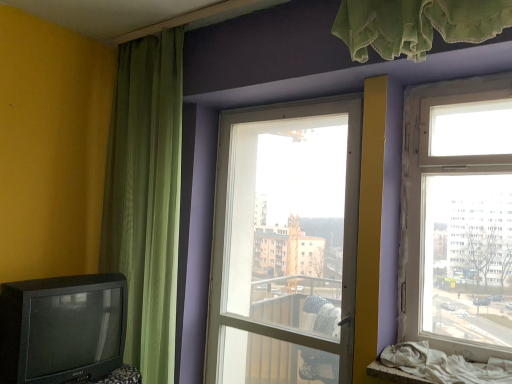
Describe the element at coordinates (146, 197) in the screenshot. The height and width of the screenshot is (384, 512). I see `green sheer curtain at left` at that location.

Where is `green sheer curtain at left`? The height and width of the screenshot is (384, 512). green sheer curtain at left is located at coordinates (146, 197).

Is transparent glass door at center, the first window viewed from the left, turned away from matte black television at lower left?

No, transparent glass door at center, the first window viewed from the left,'s orientation is not away from matte black television at lower left.

Where is `window that is the 1st one above the matte black television at lower left (from a real-world perspective)`? The height and width of the screenshot is (384, 512). window that is the 1st one above the matte black television at lower left (from a real-world perspective) is located at coordinates (285, 244).

Is transparent glass door at center, the 1th window in the back-to-front sequence, outside of matte black television at lower left?

transparent glass door at center, the 1th window in the back-to-front sequence, lies outside matte black television at lower left's area.

From a real-world perspective, is transparent glass door at center, placed as the second window when sorted from right to left, below matte black television at lower left?

No, from a real-world perspective, transparent glass door at center, placed as the second window when sorted from right to left, is not below matte black television at lower left.

How different are the orientations of clear glass window at upper right, which is counted as the first window, starting from the front, and matte black television at lower left in degrees?

90 degrees separate the facing orientations of clear glass window at upper right, which is counted as the first window, starting from the front, and matte black television at lower left.

Is clear glass window at upper right, positioned as the second window in left-to-right order, positioned in front of matte black television at lower left?

Yes, it is.

Can you confirm if clear glass window at upper right, the first window from the right, is wider than matte black television at lower left?

Incorrect, the width of clear glass window at upper right, the first window from the right, does not surpass that of matte black television at lower left.

Is clear glass window at upper right, positioned as the second window in left-to-right order, to the left of matte black television at lower left from the viewer's perspective?

In fact, clear glass window at upper right, positioned as the second window in left-to-right order, is to the right of matte black television at lower left.

From the image's perspective, is matte black television at lower left on transparent glass door at center, placed as the second window when sorted from right to left?

No, from the image's perspective, matte black television at lower left is not on top of transparent glass door at center, placed as the second window when sorted from right to left.

Which is behind, matte black television at lower left or transparent glass door at center, which is the second window from front to back?

transparent glass door at center, which is the second window from front to back, is further from the camera.

Is matte black television at lower left positioned with its back to transparent glass door at center, which is the second window from front to back?

No, matte black television at lower left is not facing away from transparent glass door at center, which is the second window from front to back.

Considering the sizes of objects matte black television at lower left and transparent glass door at center, placed as the second window when sorted from right to left, in the image provided, who is wider, matte black television at lower left or transparent glass door at center, placed as the second window when sorted from right to left,?

With larger width is matte black television at lower left.

Is green sheer curtain at left shorter than transparent glass door at center, placed as the second window when sorted from right to left?

In fact, green sheer curtain at left may be taller than transparent glass door at center, placed as the second window when sorted from right to left.

Can we say green sheer curtain at left lies outside transparent glass door at center, the first window viewed from the left?

Yes, green sheer curtain at left is located beyond the bounds of transparent glass door at center, the first window viewed from the left.

Is transparent glass door at center, placed as the second window when sorted from right to left, at the back of green sheer curtain at left?

That's not correct — green sheer curtain at left is not looking away from transparent glass door at center, placed as the second window when sorted from right to left.

Can you confirm if green sheer curtain at left is thinner than transparent glass door at center, the first window viewed from the left?

In fact, green sheer curtain at left might be wider than transparent glass door at center, the first window viewed from the left.

Is transparent glass door at center, the first window viewed from the left, to the left of clear glass window at upper right, the first window from the right, from the viewer's perspective?

Indeed, transparent glass door at center, the first window viewed from the left, is positioned on the left side of clear glass window at upper right, the first window from the right.

Does transparent glass door at center, placed as the second window when sorted from right to left, have a greater width compared to clear glass window at upper right, positioned as the second window in left-to-right order?

Indeed, transparent glass door at center, placed as the second window when sorted from right to left, has a greater width compared to clear glass window at upper right, positioned as the second window in left-to-right order.

Between transparent glass door at center, placed as the second window when sorted from right to left, and clear glass window at upper right, the first window from the right, which one has more height?

Standing taller between the two is transparent glass door at center, placed as the second window when sorted from right to left.

Which object is thinner, clear glass window at upper right, which is counted as the first window, starting from the front, or transparent glass door at center, which is the second window from front to back?

clear glass window at upper right, which is counted as the first window, starting from the front, is thinner.

Is clear glass window at upper right, the first window from the right, taller than transparent glass door at center, placed as the second window when sorted from right to left?

In fact, clear glass window at upper right, the first window from the right, may be shorter than transparent glass door at center, placed as the second window when sorted from right to left.

From the image's perspective, is clear glass window at upper right, the second window positioned from the back, located above or below transparent glass door at center, the 1th window in the back-to-front sequence?

Based on their image positions, clear glass window at upper right, the second window positioned from the back, is located above transparent glass door at center, the 1th window in the back-to-front sequence.

The height and width of the screenshot is (384, 512). I want to click on window that appears below the clear glass window at upper right, the second window positioned from the back (from a real-world perspective), so click(285, 244).

Could green sheer curtain at left be considered to be inside matte black television at lower left?

Definitely not — green sheer curtain at left is not inside matte black television at lower left.

Is matte black television at lower left facing away from green sheer curtain at left?

No, green sheer curtain at left is not at the back of matte black television at lower left.

From a real-world perspective, is matte black television at lower left positioned under green sheer curtain at left based on gravity?

Yes, from a real-world perspective, matte black television at lower left is below green sheer curtain at left.

Find the location of a particular element. window located behind the matte black television at lower left is located at coordinates (285, 244).

Locate an element on the screen. the 2nd window directly above the matte black television at lower left (from a real-world perspective) is located at coordinates (458, 217).

Estimate the real-world distances between objects in this image. Which object is closer to matte black television at lower left, clear glass window at upper right, which is counted as the first window, starting from the front, or green sheer curtain at left?

green sheer curtain at left.

Which object lies nearer to the anchor point transparent glass door at center, which is the second window from front to back, clear glass window at upper right, positioned as the second window in left-to-right order, or green sheer curtain at left?

green sheer curtain at left is closer to transparent glass door at center, which is the second window from front to back.

From the image, which object appears to be nearer to clear glass window at upper right, the second window positioned from the back, green sheer curtain at left or matte black television at lower left?

green sheer curtain at left.

Estimate the real-world distances between objects in this image. Which object is closer to green sheer curtain at left, matte black television at lower left or clear glass window at upper right, which is counted as the first window, starting from the front?

Based on the image, matte black television at lower left appears to be nearer to green sheer curtain at left.

Looking at the image, which one is located closer to clear glass window at upper right, positioned as the second window in left-to-right order, green sheer curtain at left or transparent glass door at center, the first window viewed from the left?

transparent glass door at center, the first window viewed from the left, lies closer to clear glass window at upper right, positioned as the second window in left-to-right order, than the other object.

From the image, which object appears to be nearer to matte black television at lower left, transparent glass door at center, placed as the second window when sorted from right to left, or green sheer curtain at left?

Based on the image, green sheer curtain at left appears to be nearer to matte black television at lower left.

Considering their positions, is green sheer curtain at left positioned further to transparent glass door at center, the first window viewed from the left, than matte black television at lower left?

Based on the image, matte black television at lower left appears to be further to transparent glass door at center, the first window viewed from the left.

Which object lies further to the anchor point matte black television at lower left, transparent glass door at center, which is the second window from front to back, or clear glass window at upper right, the first window from the right?

Based on the image, clear glass window at upper right, the first window from the right, appears to be further to matte black television at lower left.

Locate an element on the screen. The height and width of the screenshot is (384, 512). window between matte black television at lower left and clear glass window at upper right, positioned as the second window in left-to-right order is located at coordinates (285, 244).

The height and width of the screenshot is (384, 512). I want to click on curtain located between matte black television at lower left and clear glass window at upper right, the first window from the right, in the left-right direction, so click(x=146, y=197).

I want to click on curtain between matte black television at lower left and transparent glass door at center, the 1th window in the back-to-front sequence, in the horizontal direction, so click(146, 197).

Identify the location of window between green sheer curtain at left and clear glass window at upper right, positioned as the second window in left-to-right order. (285, 244).